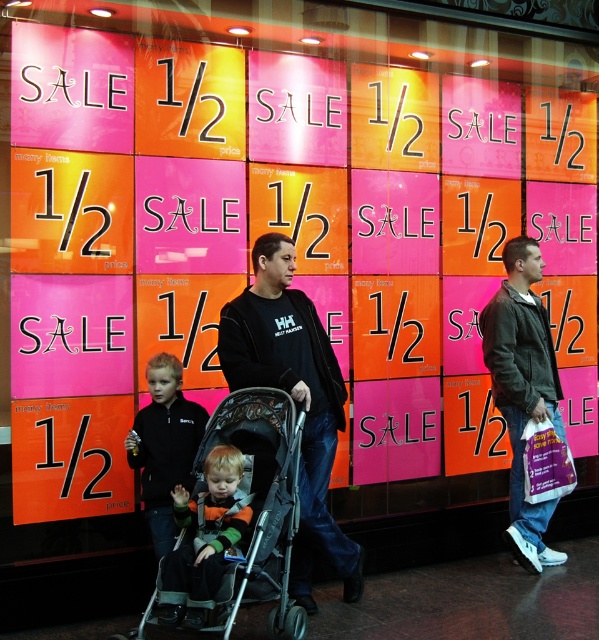
You are standing in front of the storefront window display and see two fleece jackets, the green fleece jacket at center and the black fleece jacket at center. Which one is shorter in height?

The green fleece jacket at center is not as tall as the black fleece jacket at center, so the green fleece jacket at center is shorter in height.

You are standing in front of the storefront window and want to hand a flyer to the person wearing the dark green jacket at right and the green fleece jacket at center. Which jacket should you approach first?

You should approach the dark green jacket at right first because it is closer to you than the green fleece jacket at center, which is further away.

You are a delivery person trying to navigate through the sidewalk in front of the storefront window display. You need to deliver a package to the address behind the black textured stroller at center and the green fleece jacket at center. Which object should you move around to ensure you can pass through?

The black textured stroller at center is positioned on the right side of green fleece jacket at center. To navigate through, you should move around the green fleece jacket at center since it is on the left side, allowing you to pass by the stroller on the right.